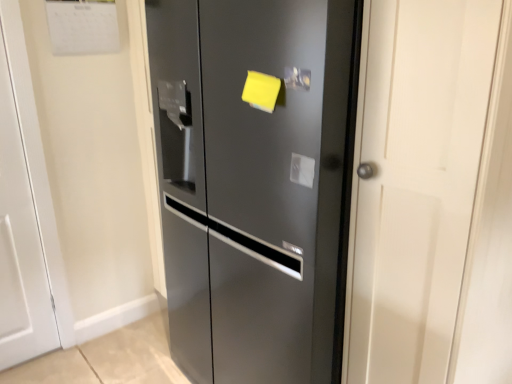
Where is `satin black refrigerator at center, which ranks as the 2th door in left-to-right order`? The width and height of the screenshot is (512, 384). satin black refrigerator at center, which ranks as the 2th door in left-to-right order is located at coordinates (252, 182).

What do you see at coordinates (252, 182) in the screenshot?
I see `satin black refrigerator at center, which is the first door in right-to-left order` at bounding box center [252, 182].

Find the location of `white matte door at left, positioned as the 2th door in right-to-left order`. white matte door at left, positioned as the 2th door in right-to-left order is located at coordinates 25,214.

This screenshot has width=512, height=384. Describe the element at coordinates (25, 214) in the screenshot. I see `white matte door at left, positioned as the 2th door in right-to-left order` at that location.

The image size is (512, 384). I want to click on satin black refrigerator at center, which ranks as the 2th door in left-to-right order, so click(252, 182).

Which object is positioned more to the right, satin black refrigerator at center, which is the first door in right-to-left order, or white matte door at left, which is counted as the first door, starting from the left?

satin black refrigerator at center, which is the first door in right-to-left order.

Considering the positions of objects satin black refrigerator at center, which ranks as the 2th door in left-to-right order, and white matte door at left, which is counted as the first door, starting from the left, in the image provided, who is in front, satin black refrigerator at center, which ranks as the 2th door in left-to-right order, or white matte door at left, which is counted as the first door, starting from the left,?

Positioned in front is satin black refrigerator at center, which ranks as the 2th door in left-to-right order.

Considering the points (312, 214) and (23, 277), which point is behind, point (312, 214) or point (23, 277)?

The point (23, 277) is behind.

From the image's perspective, is satin black refrigerator at center, which is the first door in right-to-left order, located beneath white matte door at left, which is counted as the first door, starting from the left?

Yes, from the image's perspective, satin black refrigerator at center, which is the first door in right-to-left order, is beneath white matte door at left, which is counted as the first door, starting from the left.

From a real-world perspective, relative to white matte door at left, positioned as the 2th door in right-to-left order, is satin black refrigerator at center, which ranks as the 2th door in left-to-right order, vertically above or below?

Clearly, from a real-world perspective, satin black refrigerator at center, which ranks as the 2th door in left-to-right order, is above white matte door at left, positioned as the 2th door in right-to-left order.

Can you confirm if satin black refrigerator at center, which ranks as the 2th door in left-to-right order, is wider than white matte door at left, positioned as the 2th door in right-to-left order?

Yes.

In the scene shown: Can you confirm if satin black refrigerator at center, which ranks as the 2th door in left-to-right order, is shorter than white matte door at left, which is counted as the first door, starting from the left?

In fact, satin black refrigerator at center, which ranks as the 2th door in left-to-right order, may be taller than white matte door at left, which is counted as the first door, starting from the left.

Considering the sizes of objects satin black refrigerator at center, which is the first door in right-to-left order, and white matte door at left, positioned as the 2th door in right-to-left order, in the image provided, who is bigger, satin black refrigerator at center, which is the first door in right-to-left order, or white matte door at left, positioned as the 2th door in right-to-left order,?

satin black refrigerator at center, which is the first door in right-to-left order, is bigger.

Is satin black refrigerator at center, which ranks as the 2th door in left-to-right order, situated inside white matte door at left, which is counted as the first door, starting from the left, or outside?

satin black refrigerator at center, which ranks as the 2th door in left-to-right order, is not enclosed by white matte door at left, which is counted as the first door, starting from the left.

Consider the image. Can you see satin black refrigerator at center, which is the first door in right-to-left order, touching white matte door at left, positioned as the 2th door in right-to-left order?

satin black refrigerator at center, which is the first door in right-to-left order, and white matte door at left, positioned as the 2th door in right-to-left order, are not in contact.

Is satin black refrigerator at center, which ranks as the 2th door in left-to-right order, facing towards white matte door at left, positioned as the 2th door in right-to-left order?

No, satin black refrigerator at center, which ranks as the 2th door in left-to-right order, is not oriented towards white matte door at left, positioned as the 2th door in right-to-left order.

What's the angular difference between satin black refrigerator at center, which ranks as the 2th door in left-to-right order, and white matte door at left, which is counted as the first door, starting from the left,'s facing directions?

The angular difference between satin black refrigerator at center, which ranks as the 2th door in left-to-right order, and white matte door at left, which is counted as the first door, starting from the left, is 91.7 degrees.

How far apart are satin black refrigerator at center, which is the first door in right-to-left order, and white matte door at left, which is counted as the first door, starting from the left?

A distance of 38.73 inches exists between satin black refrigerator at center, which is the first door in right-to-left order, and white matte door at left, which is counted as the first door, starting from the left.

This screenshot has height=384, width=512. Find the location of `door that appears on the left of satin black refrigerator at center, which ranks as the 2th door in left-to-right order`. door that appears on the left of satin black refrigerator at center, which ranks as the 2th door in left-to-right order is located at coordinates (25, 214).

Is white matte door at left, which is counted as the first door, starting from the left, at the right side of satin black refrigerator at center, which is the first door in right-to-left order?

Incorrect, white matte door at left, which is counted as the first door, starting from the left, is not on the right side of satin black refrigerator at center, which is the first door in right-to-left order.

Who is more distant, white matte door at left, positioned as the 2th door in right-to-left order, or satin black refrigerator at center, which ranks as the 2th door in left-to-right order?

white matte door at left, positioned as the 2th door in right-to-left order, is further away from the camera.

Does point (44, 224) come in front of point (186, 351)?

No, it is not.

From the image's perspective, between white matte door at left, positioned as the 2th door in right-to-left order, and satin black refrigerator at center, which is the first door in right-to-left order, who is located below?

satin black refrigerator at center, which is the first door in right-to-left order.

Looking at this image, from a real-world perspective, between white matte door at left, positioned as the 2th door in right-to-left order, and satin black refrigerator at center, which is the first door in right-to-left order, who is vertically higher?

satin black refrigerator at center, which is the first door in right-to-left order, is physically above.

Considering the sizes of white matte door at left, which is counted as the first door, starting from the left, and satin black refrigerator at center, which is the first door in right-to-left order, in the image, is white matte door at left, which is counted as the first door, starting from the left, wider or thinner than satin black refrigerator at center, which is the first door in right-to-left order,?

Clearly, white matte door at left, which is counted as the first door, starting from the left, has less width compared to satin black refrigerator at center, which is the first door in right-to-left order.

Considering the relative sizes of white matte door at left, which is counted as the first door, starting from the left, and satin black refrigerator at center, which ranks as the 2th door in left-to-right order, in the image provided, is white matte door at left, which is counted as the first door, starting from the left, taller than satin black refrigerator at center, which ranks as the 2th door in left-to-right order,?

No.

Considering the relative sizes of white matte door at left, positioned as the 2th door in right-to-left order, and satin black refrigerator at center, which ranks as the 2th door in left-to-right order, in the image provided, is white matte door at left, positioned as the 2th door in right-to-left order, smaller than satin black refrigerator at center, which ranks as the 2th door in left-to-right order,?

Indeed, white matte door at left, positioned as the 2th door in right-to-left order, has a smaller size compared to satin black refrigerator at center, which ranks as the 2th door in left-to-right order.

Is white matte door at left, positioned as the 2th door in right-to-left order, inside the boundaries of satin black refrigerator at center, which ranks as the 2th door in left-to-right order, or outside?

white matte door at left, positioned as the 2th door in right-to-left order, is located beyond the bounds of satin black refrigerator at center, which ranks as the 2th door in left-to-right order.

Are white matte door at left, which is counted as the first door, starting from the left, and satin black refrigerator at center, which is the first door in right-to-left order, located far from each other?

white matte door at left, which is counted as the first door, starting from the left, is actually quite close to satin black refrigerator at center, which is the first door in right-to-left order.

In the scene shown: Is white matte door at left, which is counted as the first door, starting from the left, aimed at satin black refrigerator at center, which ranks as the 2th door in left-to-right order?

No, white matte door at left, which is counted as the first door, starting from the left, is not turned towards satin black refrigerator at center, which ranks as the 2th door in left-to-right order.

How many degrees apart are the facing directions of white matte door at left, positioned as the 2th door in right-to-left order, and satin black refrigerator at center, which is the first door in right-to-left order?

The angular difference between white matte door at left, positioned as the 2th door in right-to-left order, and satin black refrigerator at center, which is the first door in right-to-left order, is 91.7 degrees.

Measure the distance from white matte door at left, positioned as the 2th door in right-to-left order, to satin black refrigerator at center, which ranks as the 2th door in left-to-right order.

A distance of 38.73 inches exists between white matte door at left, positioned as the 2th door in right-to-left order, and satin black refrigerator at center, which ranks as the 2th door in left-to-right order.

The image size is (512, 384). Find the location of `door that appears on the left of satin black refrigerator at center, which ranks as the 2th door in left-to-right order`. door that appears on the left of satin black refrigerator at center, which ranks as the 2th door in left-to-right order is located at coordinates (25, 214).

Find the location of a particular element. The width and height of the screenshot is (512, 384). door located behind the satin black refrigerator at center, which is the first door in right-to-left order is located at coordinates (25, 214).

At what (x,y) coordinates should I click in order to perform the action: click on door located on the left of satin black refrigerator at center, which ranks as the 2th door in left-to-right order. Please return your answer as a coordinate pair (x, y). Looking at the image, I should click on (25, 214).